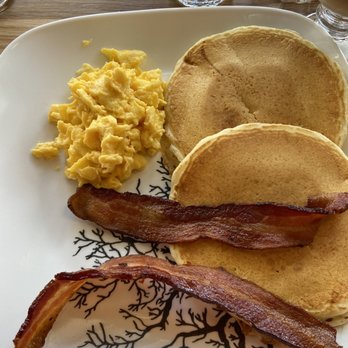
Where is `glass`? The image size is (348, 348). glass is located at coordinates pos(325,15).